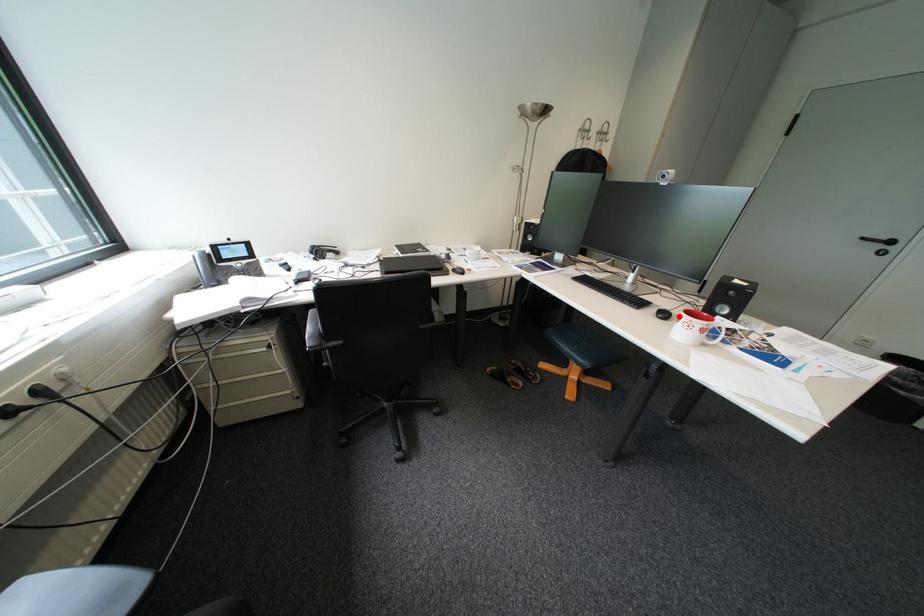
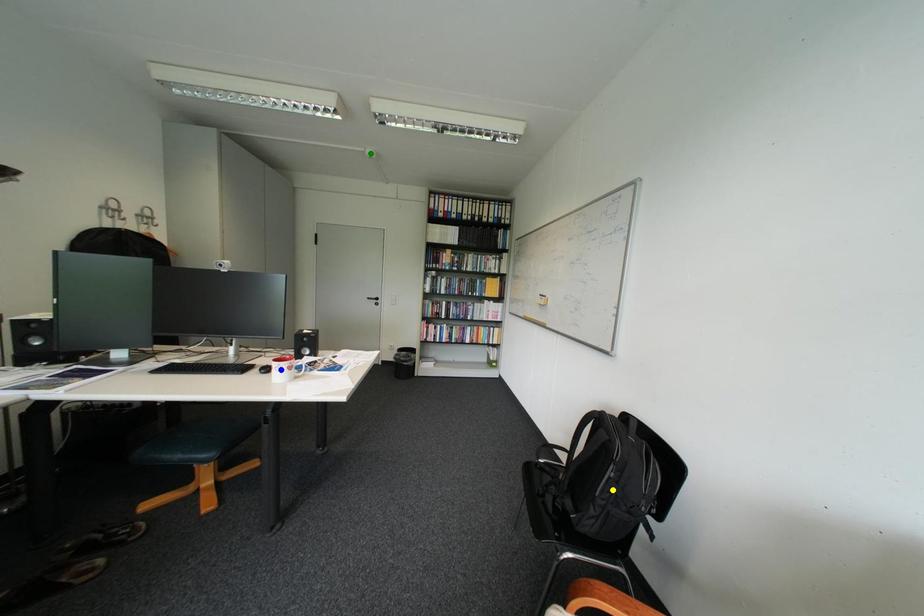
Question: I am providing you with two images of the same scene from different viewpoints. A red point is marked on the first image. You are given multiple points on the second image. Which spot in image 2 lines up with the point in image 1?

Choices:
 (A) blue point
 (B) green point
 (C) yellow point

Answer: (A)